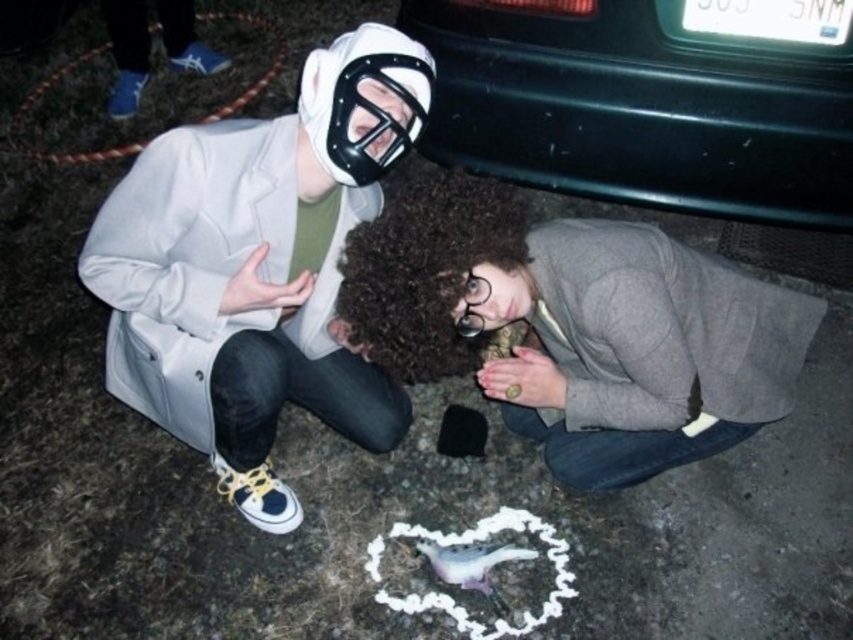
You are a photographer setting up a night shoot. You need to position a spotlight so it can illuminate both the gray wool sweater at lower center and the black plastic car at upper right without casting shadows over the main subjects. Based on their positions, where should you place the spotlight relative to these objects?

The gray wool sweater at lower center is in front of the black plastic car at upper right. To avoid casting shadows over the main subjects, the spotlight should be placed behind both objects, shining towards them from the upper left direction.

You are a photographer trying to capture the white matte mask at upper left. You have a camera with a rectangular viewfinder. The viewfinder has a center point at coordinates 0.5, 0.5. The mask is located at point (257, 268). Will the mask be centered in your viewfinder?

The white matte mask at upper left is located at point (257, 268), which is slightly to the left and down from the viewfinder center at 0.5, 0.5. Therefore, the mask will not be centered in the viewfinder.

You are a photographer setting up a lighting rig for a nighttime photoshoot. You need to ensure that the white matte mask at upper left and the gray wool sweater at lower center are both well lit. Given their positions, which object should you adjust the light first to illuminate properly?

The white matte mask at upper left should be adjusted first since it is positioned above the gray wool sweater at lower center, meaning its light may naturally fall on the sweater below. By adjusting the upper light first, you can ensure both are properly illuminated without overexposing the lower object.